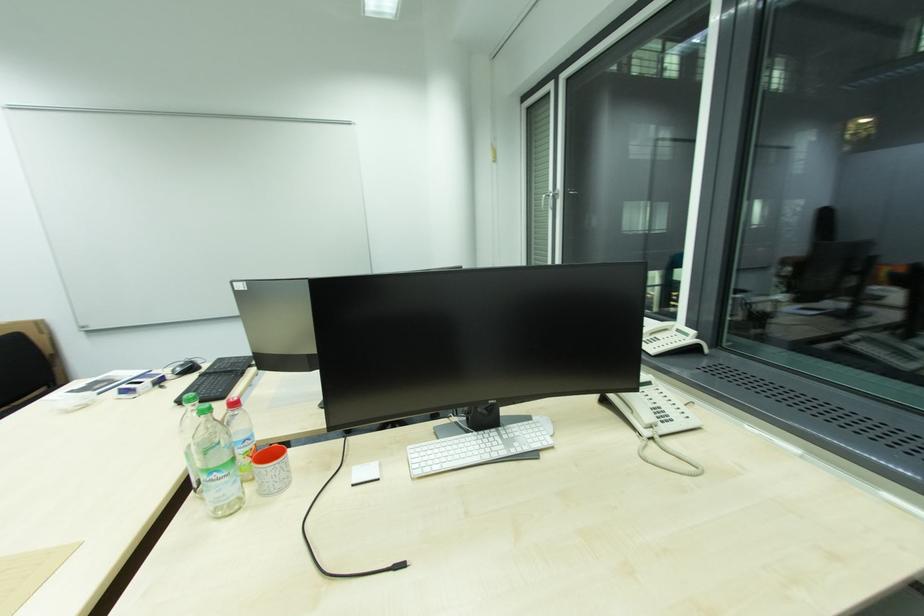
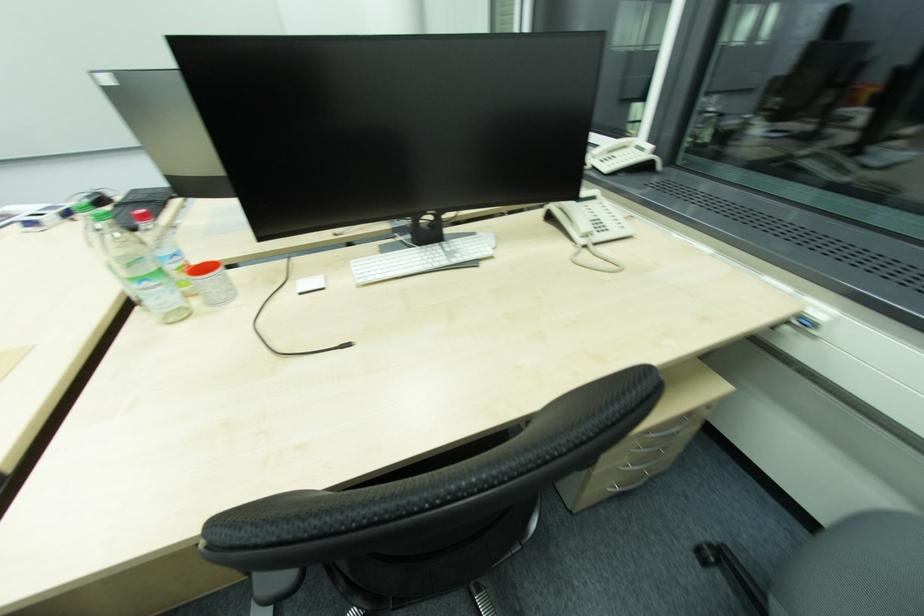
Question: How did the camera likely rotate?

Choices:
 (A) Left
 (B) Right
 (C) Up
 (D) Down

Answer: (D)